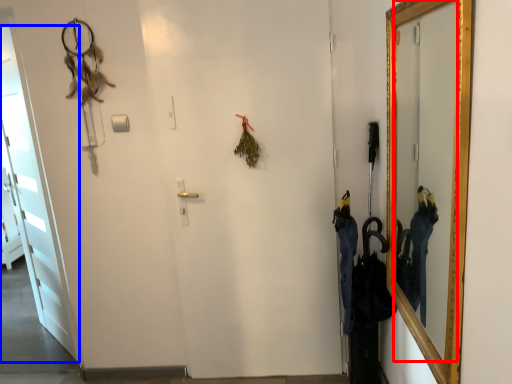
Question: Which object appears closest to the camera in this image, mirror (highlighted by a red box) or door (highlighted by a blue box)?

Choices:
 (A) mirror
 (B) door

Answer: (A)